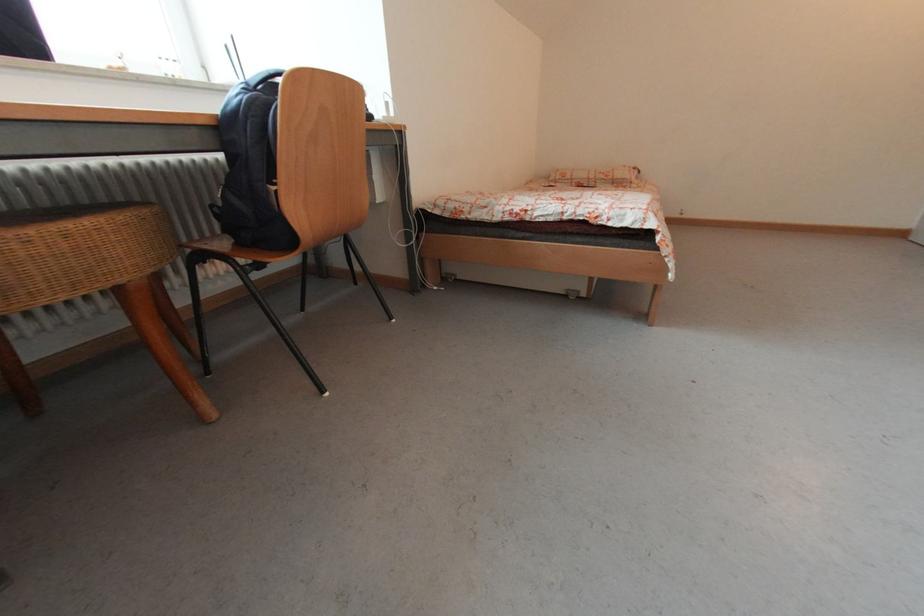
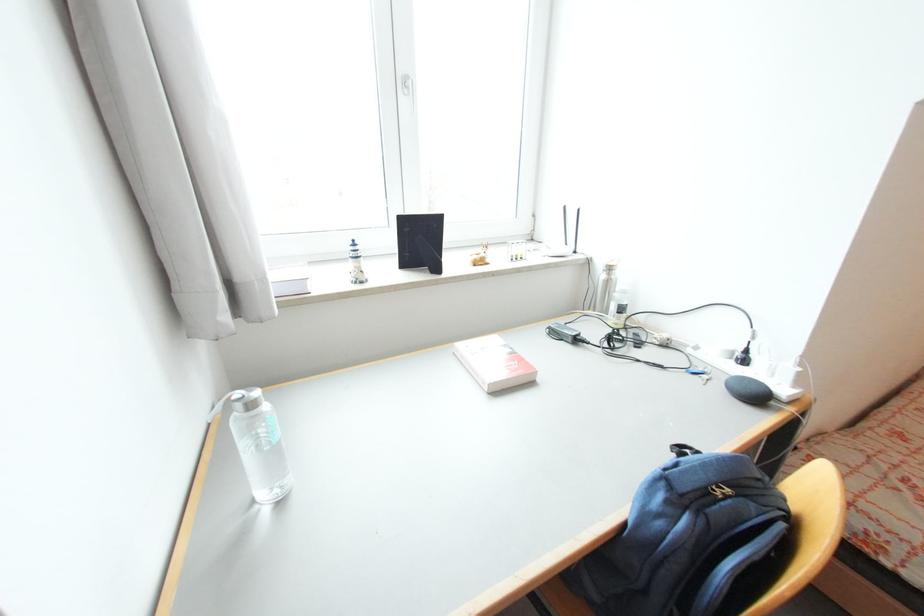
Question: The camera is either moving clockwise (left) or counter-clockwise (right) around the object. The first image is from the beginning of the video and the second image is from the end. Is the camera moving left or right when shooting the video?

Choices:
 (A) Left
 (B) Right

Answer: (B)